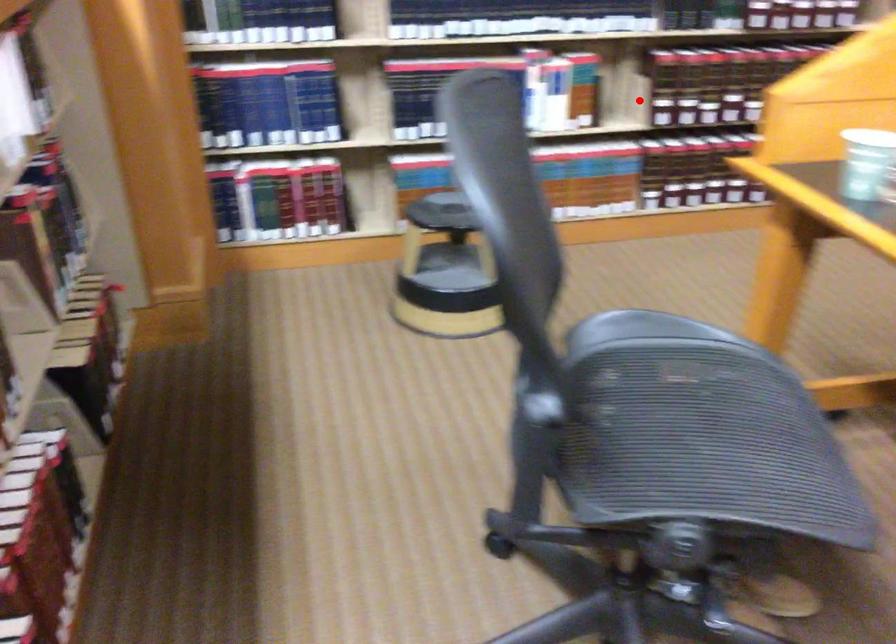
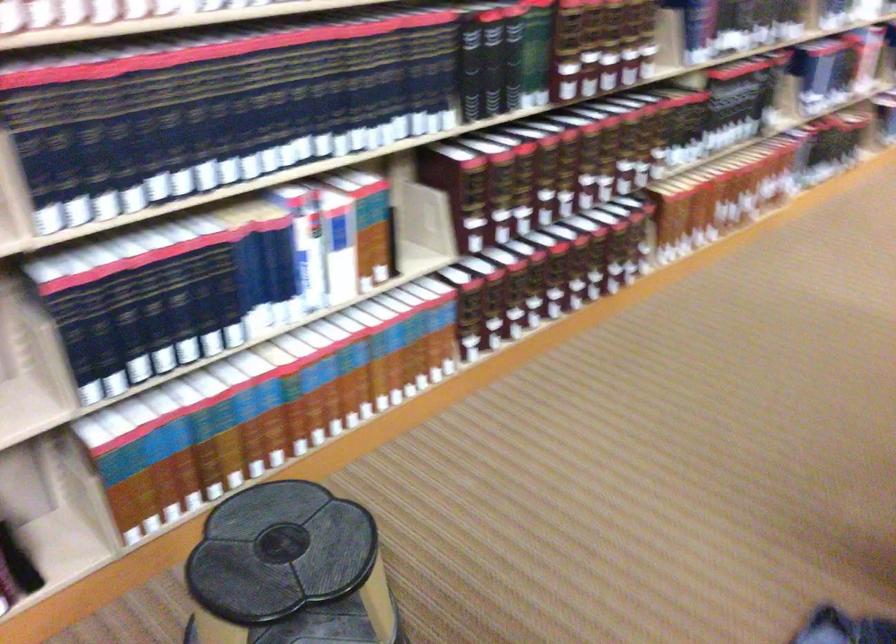
The point at the highlighted location is marked in the first image. Where is the corresponding point in the second image?

(421, 228)